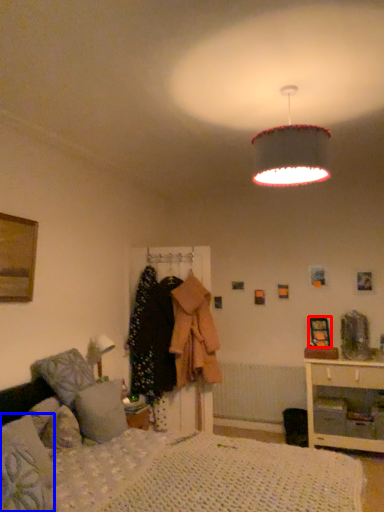
Question: Which object is further to the camera taking this photo, picture frame (highlighted by a red box) or pillow (highlighted by a blue box)?

Choices:
 (A) picture frame
 (B) pillow

Answer: (A)